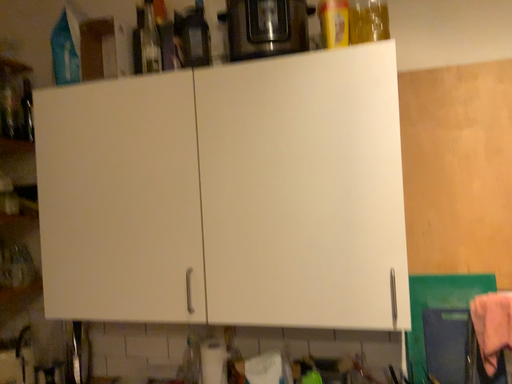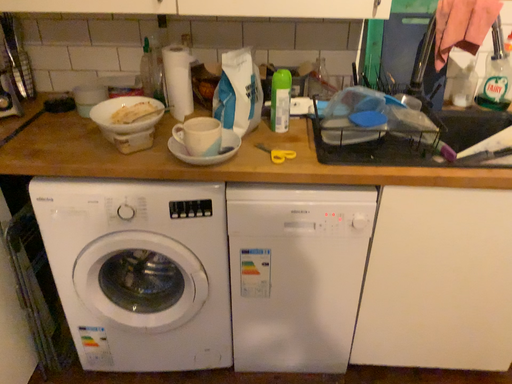
Question: Which way did the camera rotate in the video?

Choices:
 (A) rotated upward
 (B) rotated downward

Answer: (B)